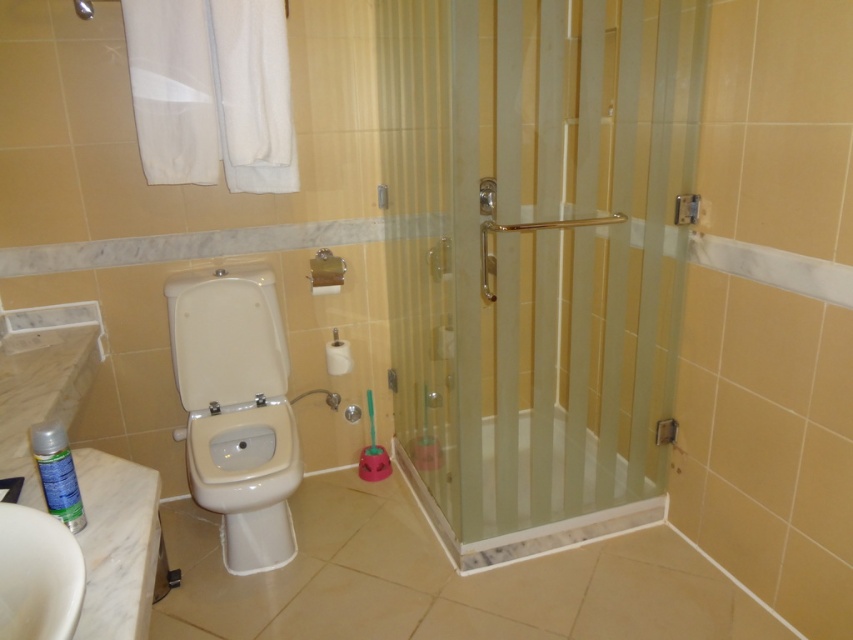
You are a home inspector evaluating the bathroom layout. You notice the white glossy toilet at left and the green matte spray can at lower left. Which object is taller?

The white glossy toilet at left is taller than the green matte spray can at lower left.

You are a bathroom cleaner who needs to place the green matte spray can at lower left next to the white glossy sink at lower left. Since both are at the lower left, which one should be placed to the right to fit better?

The white glossy sink at lower left is wider than the green matte spray can at lower left, so placing the spray can to the right of the sink would allow it to fit better in the space.

You are standing in the bathroom and need to reach both the white glossy toilet at left and the white glossy sink at lower left. Which object is closer to your current position if you are facing the bathroom entrance?

The white glossy sink at lower left is closer to your current position because the white glossy toilet at left is positioned on the left side of it, meaning the sink is between you and the toilet when facing the entrance.